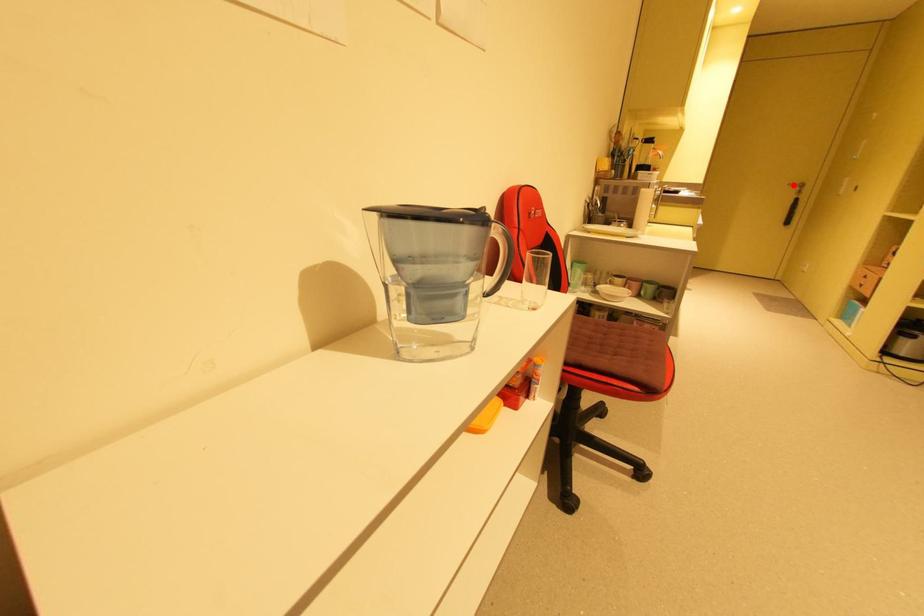
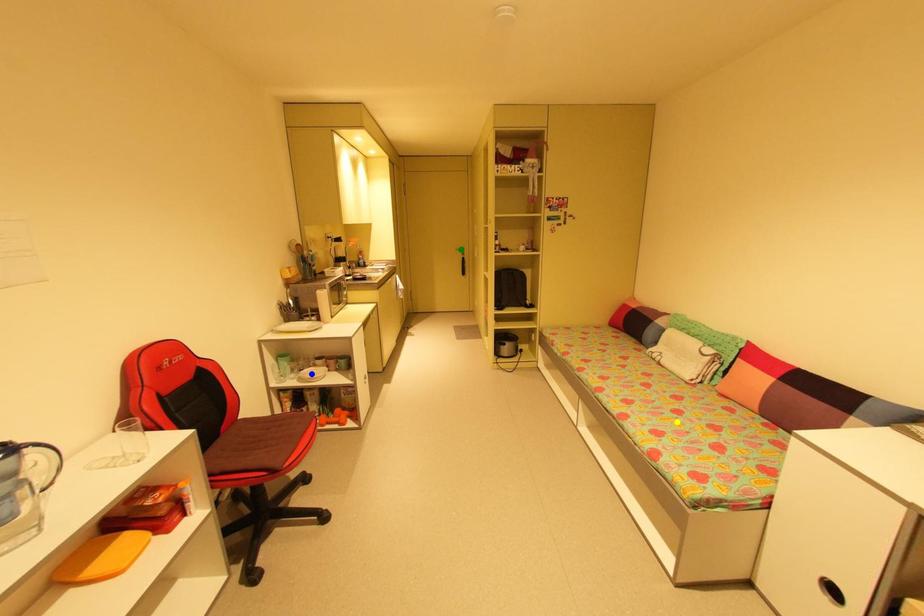
Question: I am providing you with two images of the same scene from different viewpoints. A red point is marked on the first image. You are given multiple points on the second image. Which point in image 2 is actually the same real-world point as the red point in image 1?

Choices:
 (A) green point
 (B) yellow point
 (C) blue point

Answer: (A)